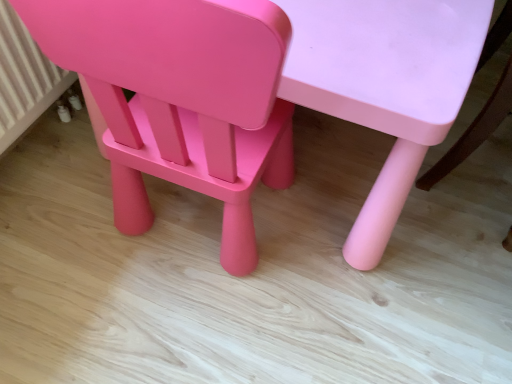
In order to click on vacant space that is to the left of matte plastic chair at center in this screenshot , I will do `click(61, 209)`.